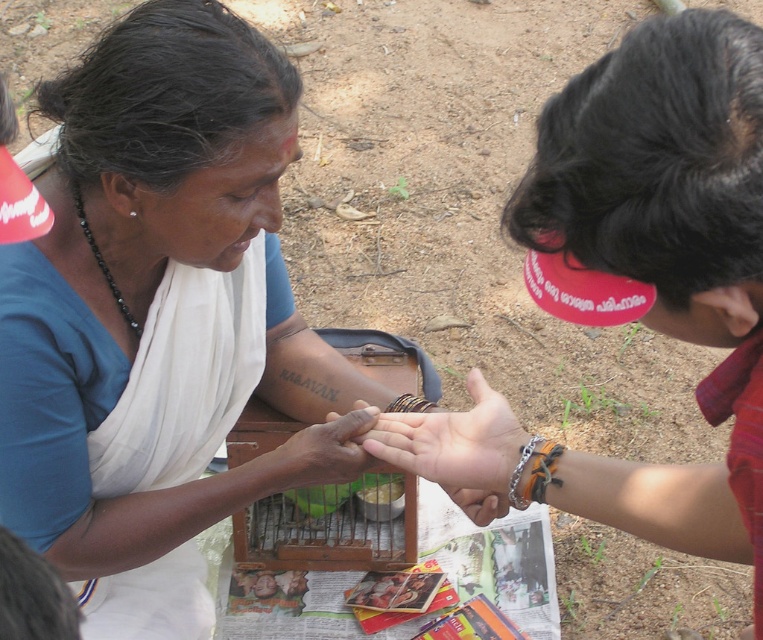
Question: Does smooth skin hand at center have a larger size compared to dark skin hand at center?

Choices:
 (A) yes
 (B) no

Answer: (A)

Question: Which point appears closest to the camera in this image?

Choices:
 (A) (549, 456)
 (B) (636, 51)

Answer: (B)

Question: Is matte blue shirt at upper left bigger than gold chain bracelet at center?

Choices:
 (A) no
 (B) yes

Answer: (B)

Question: Which point appears farthest from the camera in this image?

Choices:
 (A) (423, 400)
 (B) (744, 160)
 (C) (76, 275)

Answer: (A)

Question: Which object is positioned farthest from the silver metallic bracelet at lower center?

Choices:
 (A) gold chain bracelet at center
 (B) brown leather bracelet at center
 (C) dark skin hand at center
 (D) matte red cap at upper right

Answer: (B)

Question: Does smooth skin hand at center have a larger size compared to brown leather bracelet at center?

Choices:
 (A) yes
 (B) no

Answer: (A)